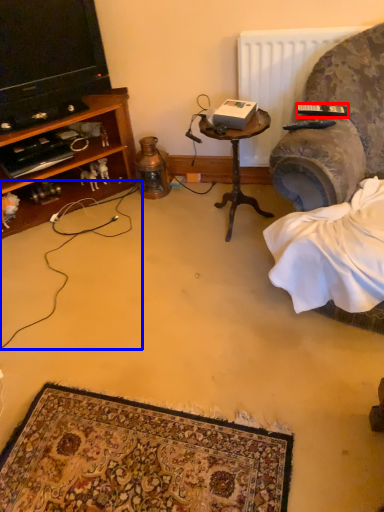
Question: Among these objects, which one is nearest to the camera, remote control (highlighted by a red box) or string (highlighted by a blue box)?

Choices:
 (A) remote control
 (B) string

Answer: (B)